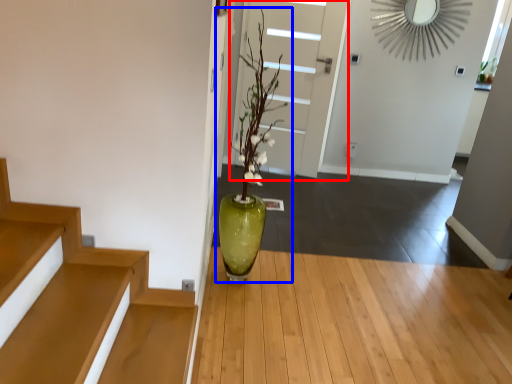
Question: Which object appears farthest to the camera in this image, door (highlighted by a red box) or houseplant (highlighted by a blue box)?

Choices:
 (A) door
 (B) houseplant

Answer: (A)